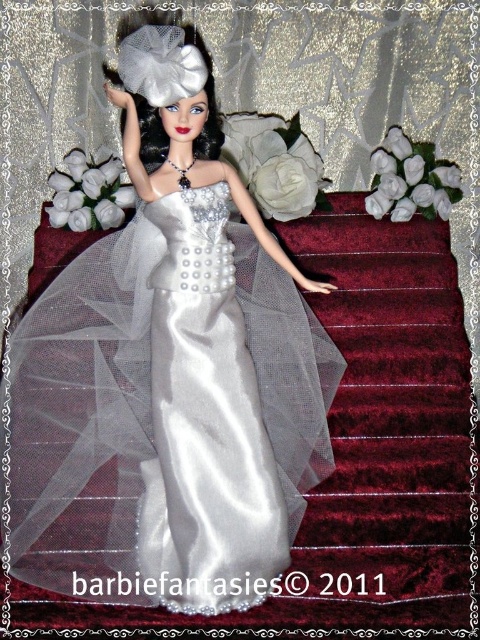
Question: Does satin dress at center have a larger size compared to satin/pearl wedding dress at center?

Choices:
 (A) yes
 (B) no

Answer: (A)

Question: Which of the following is the farthest from the observer?

Choices:
 (A) satin/pearl wedding dress at center
 (B) satin dress at center

Answer: (A)

Question: Which of the following is the farthest from the observer?

Choices:
 (A) (46, 374)
 (B) (168, 257)

Answer: (A)

Question: Can you confirm if satin dress at center is smaller than satin/pearl wedding dress at center?

Choices:
 (A) no
 (B) yes

Answer: (A)

Question: Which point is farther to the camera?

Choices:
 (A) (222, 326)
 (B) (338, 380)

Answer: (B)

Question: Does satin dress at center appear on the right side of satin/pearl wedding dress at center?

Choices:
 (A) no
 (B) yes

Answer: (A)